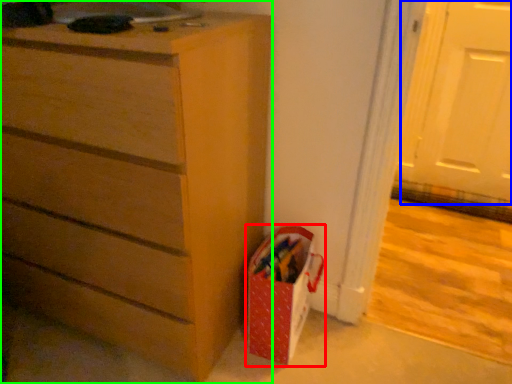
Question: Estimate the real-world distances between objects in this image. Which object is closer to gift bag (highlighted by a red box), screen door (highlighted by a blue box) or chest of drawers (highlighted by a green box)?

Choices:
 (A) screen door
 (B) chest of drawers

Answer: (B)